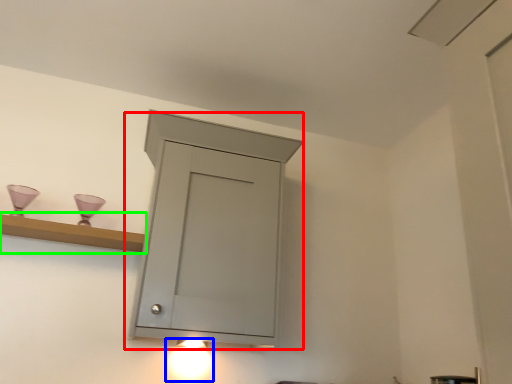
Question: Based on their relative distances, which object is nearer to cupboard (highlighted by a red box)? Choose from light fixture (highlighted by a blue box) and shelf (highlighted by a green box).

Choices:
 (A) light fixture
 (B) shelf

Answer: (B)